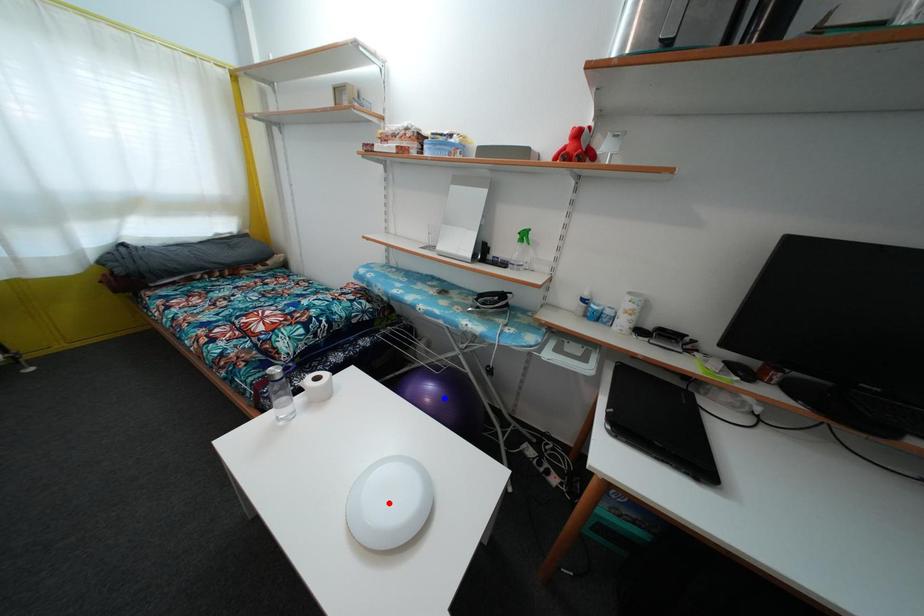
Question: Which of the two points in the image is closer to the camera?

Choices:
 (A) Blue point is closer.
 (B) Red point is closer.

Answer: (B)